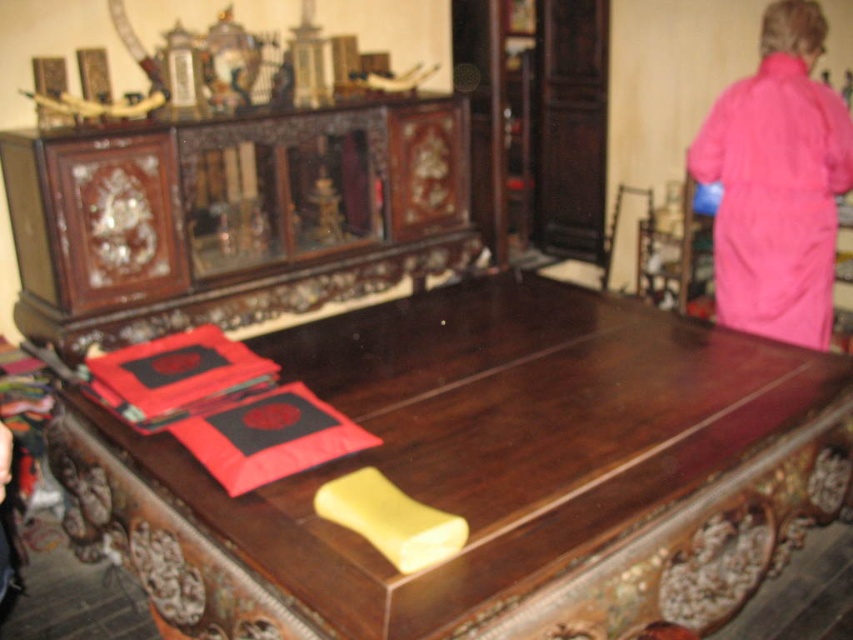
You are organizing a small event and need to place a 1.2 meter long centerpiece on the polished wood table at center. Considering the size of the pink fabric robe at upper right, will the table have enough space for the centerpiece?

The polished wood table at center is larger in size than the pink fabric robe at upper right. Since the table is bigger, it likely has sufficient space to accommodate the 1.2 meter long centerpiece.

From the picture: You are organizing a fashion show and need to choose between the pink fabric robe at upper right and the matte red fabric at left for a model. Which fabric item is bigger in size?

The pink fabric robe at upper right has a larger size compared to the matte red fabric at left, so the pink fabric robe at upper right is bigger.